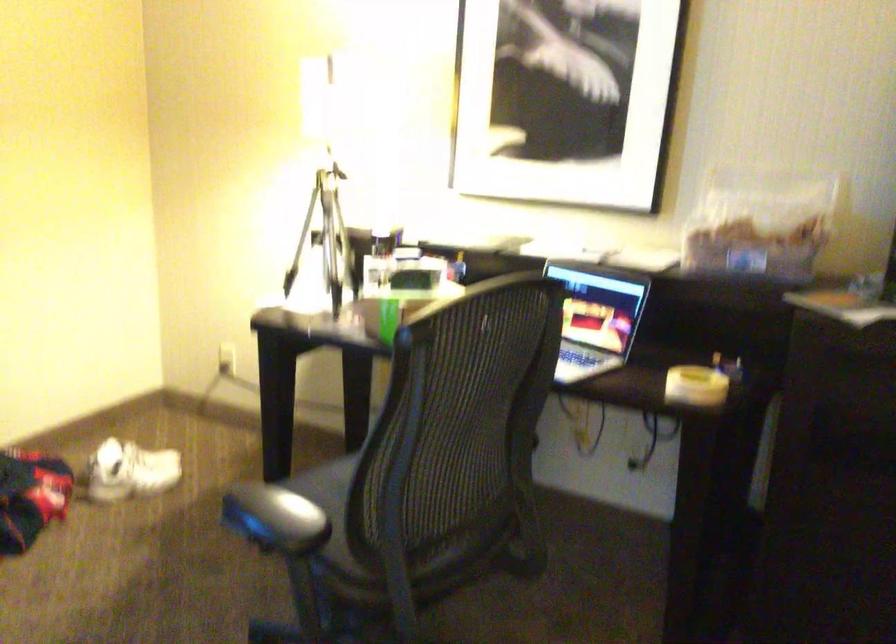
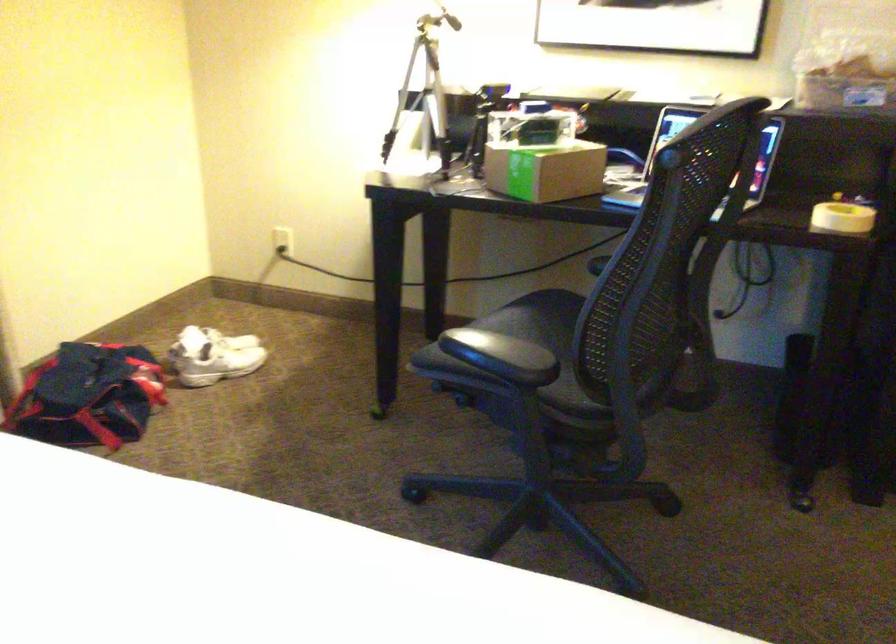
In the second image, find the point that corresponds to the point at 117,471 in the first image.

(213, 355)